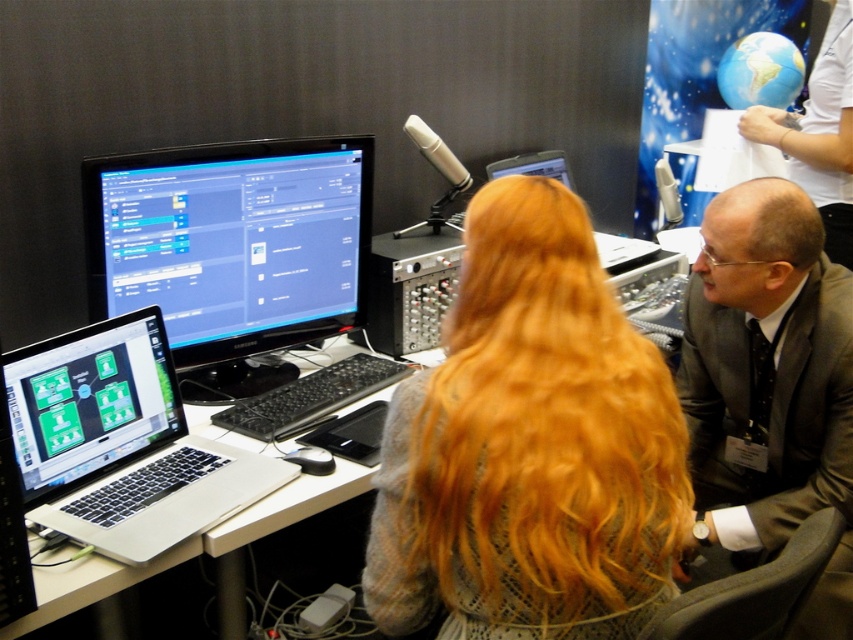
Question: Which point is closer to the camera?

Choices:
 (A) white plastic computer desk at center
 (B) silver/black laptop at lower left
 (C) matte black monitor at center

Answer: (A)

Question: Based on their relative distances, which object is farther from the matte black laptop at left?

Choices:
 (A) gray suit jacket at right
 (B) blonde hair at center
 (C) matte black monitor at center
 (D) white plastic computer desk at center

Answer: (A)

Question: Is blonde hair at center below gray suit jacket at right?

Choices:
 (A) yes
 (B) no

Answer: (B)

Question: Can you confirm if matte black monitor at center is positioned above gray suit jacket at right?

Choices:
 (A) no
 (B) yes

Answer: (B)

Question: Is blonde hair at center closer to the viewer compared to white plastic computer desk at center?

Choices:
 (A) no
 (B) yes

Answer: (B)

Question: Which point appears closest to the camera in this image?

Choices:
 (A) (844, 612)
 (B) (241, 321)

Answer: (A)